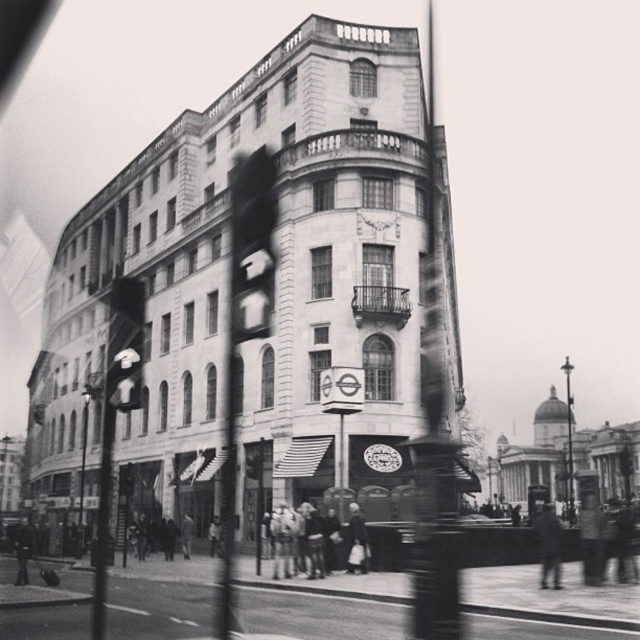
In order to click on dark gray coat at center in this screenshot , I will do `click(548, 545)`.

Is dark gray coat at center thinner than dark gray coat at lower left?

Yes, dark gray coat at center is thinner than dark gray coat at lower left.

Describe the element at coordinates (548, 545) in the screenshot. This screenshot has height=640, width=640. I see `dark gray coat at center` at that location.

Where is `dark gray coat at center`? The height and width of the screenshot is (640, 640). dark gray coat at center is located at coordinates (548, 545).

Does metallic streetlight at right have a greater height compared to light beige fabric coat at center?

Yes.

Which is more to the left, metallic streetlight at right or light beige fabric coat at center?

From the viewer's perspective, light beige fabric coat at center appears more on the left side.

Between point (570, 435) and point (214, 547), which one is positioned in front?

Point (214, 547) is more forward.

The width and height of the screenshot is (640, 640). I want to click on metallic streetlight at right, so click(568, 436).

Is point (548, 538) behind point (209, 548)?

No.

Is dark gray coat at center further to camera compared to light beige fabric coat at center?

No, it is in front of light beige fabric coat at center.

Does point (547, 508) come closer to viewer compared to point (216, 516)?

That is True.

Locate an element on the screen. Image resolution: width=640 pixels, height=640 pixels. dark gray coat at center is located at coordinates (548, 545).